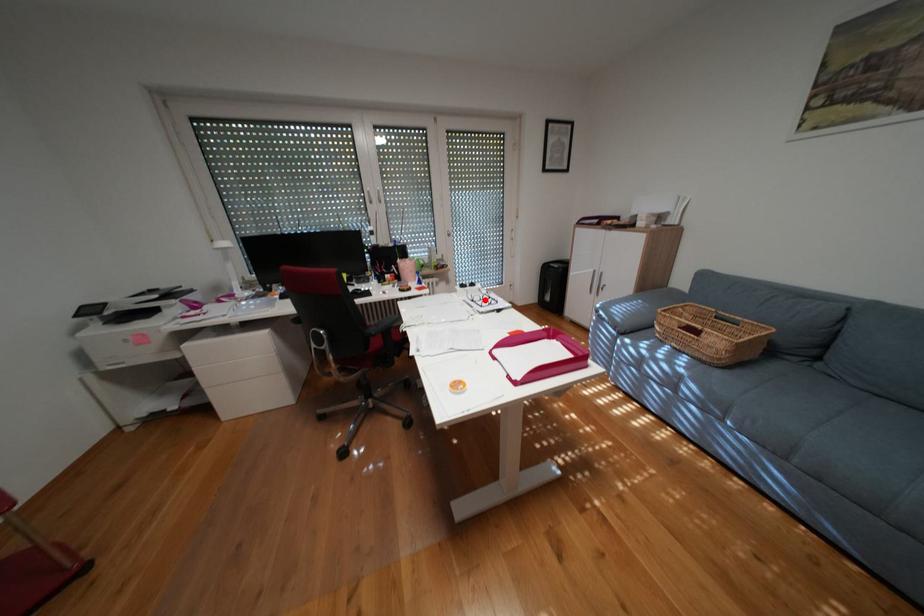
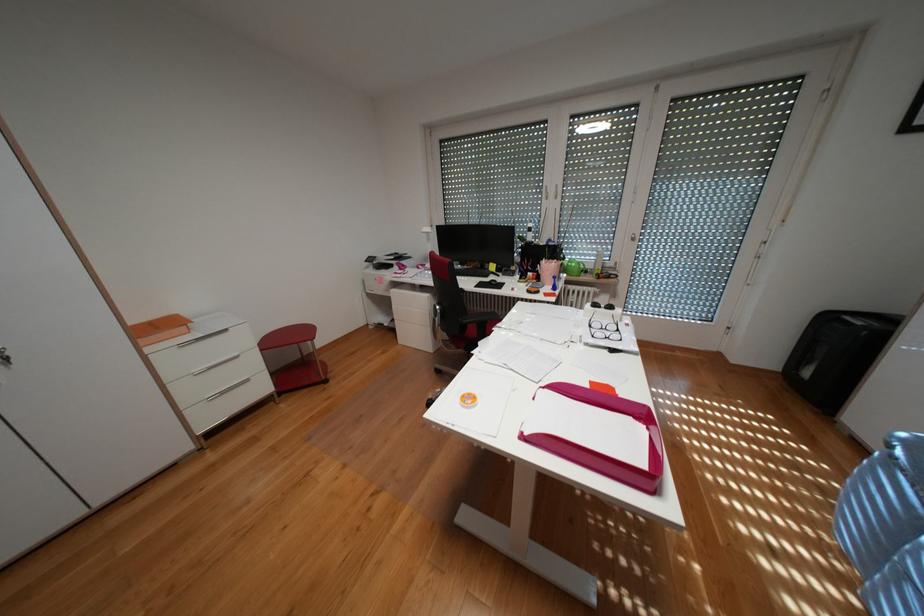
Locate, in the second image, the point that corresponds to the highlighted location in the first image.

(602, 325)